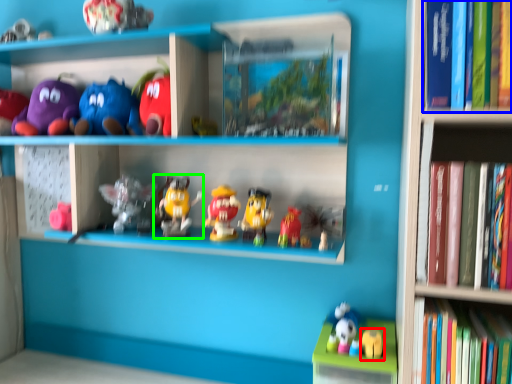
Question: Which object is positioned closest to toy (highlighted by a red box)? Select from book (highlighted by a blue box) and toy (highlighted by a green box).

Choices:
 (A) book
 (B) toy

Answer: (B)